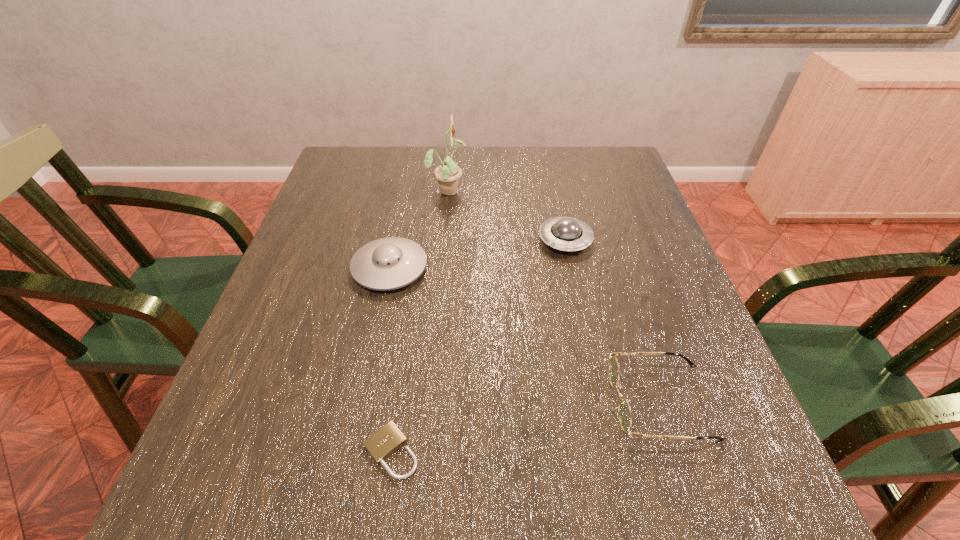
Where is `vacant space that's between the left saucer and the right saucer`? vacant space that's between the left saucer and the right saucer is located at coordinates (477, 254).

Where is `vacant space that's between the right saucer and the left saucer`? This screenshot has height=540, width=960. vacant space that's between the right saucer and the left saucer is located at coordinates (477, 254).

Locate an element on the screen. The image size is (960, 540). unoccupied area between the sunflower and the left saucer is located at coordinates click(419, 229).

Image resolution: width=960 pixels, height=540 pixels. Identify the location of object that ranks as the closest to the right saucer. (448, 173).

Identify which object is the fourth nearest to the spectacles. Please provide its 2D coordinates. Your answer should be formatted as a tuple, i.e. [(x, y)], where the tuple contains the x and y coordinates of a point satisfying the conditions above.

[(448, 173)]

Find the location of a particular element. Image resolution: width=960 pixels, height=540 pixels. free spot that satisfies the following two spatial constraints: 1. on the front-facing side of the farthest object; 2. on the front side of the padlock is located at coordinates (423, 451).

Locate an element on the screen. The image size is (960, 540). vacant area that satisfies the following two spatial constraints: 1. on the front-facing side of the right saucer; 2. on the left side of the sunflower is located at coordinates coord(443,240).